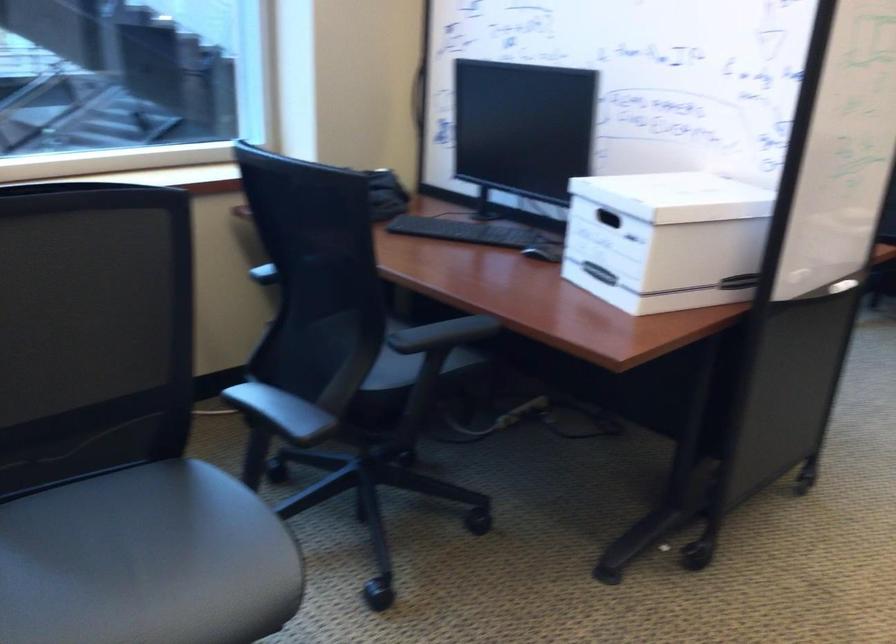
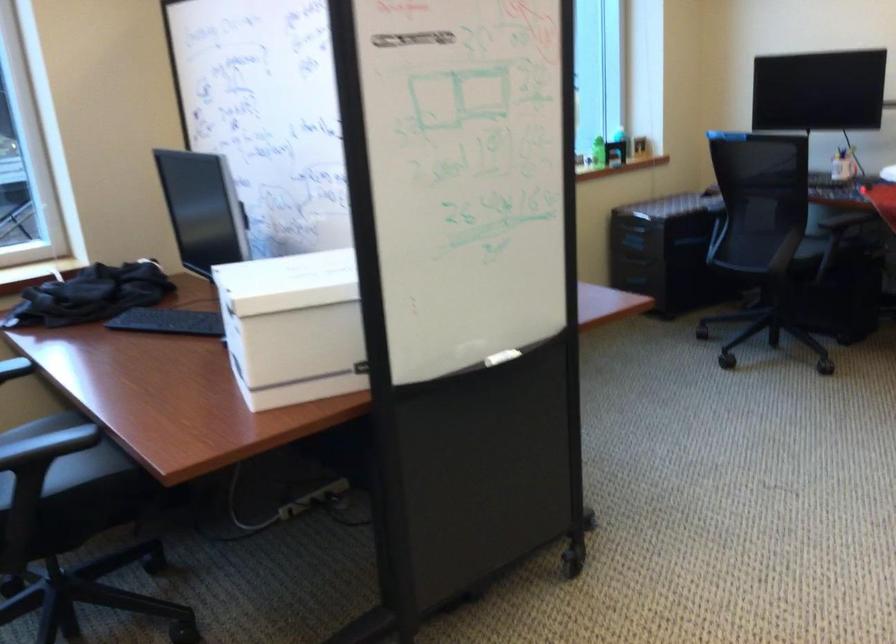
The point at (684, 242) is marked in the first image. Where is the corresponding point in the second image?

(293, 327)